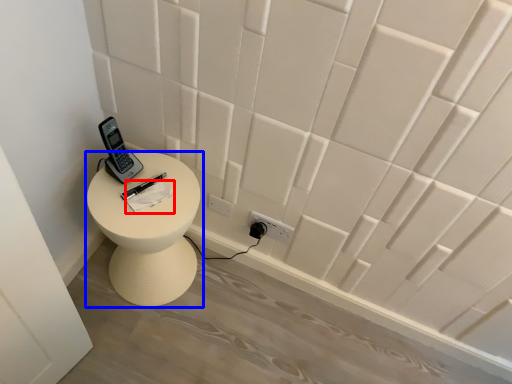
Question: Among these objects, which one is farthest to the camera, notepad (highlighted by a red box) or furniture (highlighted by a blue box)?

Choices:
 (A) notepad
 (B) furniture

Answer: (A)